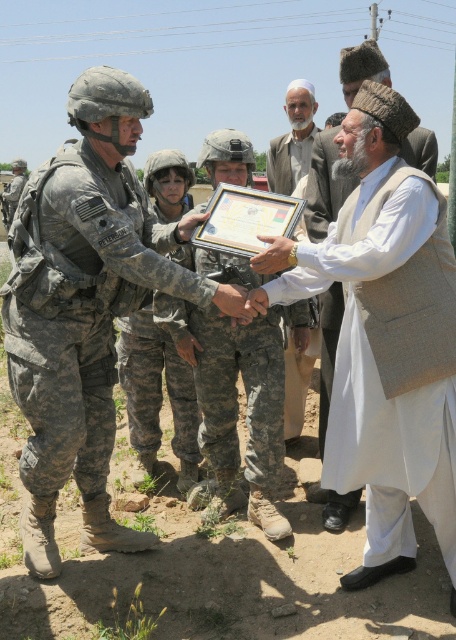
You are a photographer positioned at the center of the scene. You want to capture a closeup shot of the camouflage uniform at left. Which direction should you move to get closer to it?

Since the camouflage uniform at left is located at point 0.481 on the x axis and 0.189 on the y axis, you should move to the left and slightly downward to get closer to it.

You are a photographer standing at the back of the scene. You need to capture a photo where both the camouflage uniform at left and the beige woolen cap at center are in focus. The camera you are using has a depth of field that can cover objects within a 1.2 meters range. Will you be able to achieve this?

The camouflage uniform at left and beige woolen cap at center are 1.18 meters apart from each other. Since the distance between them is within the camera depth of field range of 1.2 meters, both objects will be in focus in the photo.